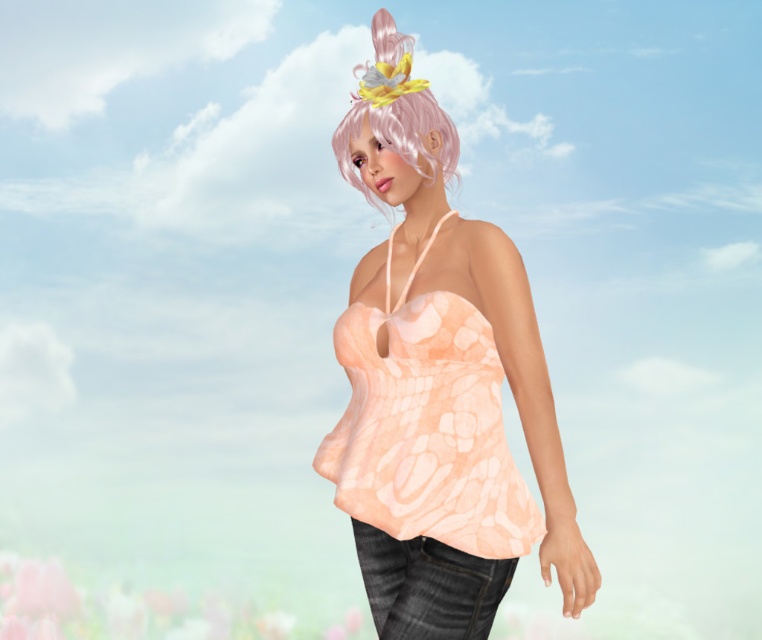
In the scene shown: Does peachy fabric top at center appear on the right side of pastel peach fabric dress at center?

Indeed, peachy fabric top at center is positioned on the right side of pastel peach fabric dress at center.

Is point (447, 570) positioned before point (396, 410)?

No, it is not.

Is point (354, 109) positioned behind point (328, 442)?

No, it is not.

Locate an element on the screen. peachy fabric top at center is located at coordinates (439, 380).

Which is more to the left, pastel peach fabric dress at center or pink matte wig at upper center?

pink matte wig at upper center is more to the left.

Can you confirm if pastel peach fabric dress at center is taller than pink matte wig at upper center?

Correct, pastel peach fabric dress at center is much taller as pink matte wig at upper center.

Where is `pastel peach fabric dress at center`? The height and width of the screenshot is (640, 762). pastel peach fabric dress at center is located at coordinates (426, 426).

Does peachy fabric top at center have a greater height compared to pink matte wig at upper center?

Indeed, peachy fabric top at center has a greater height compared to pink matte wig at upper center.

Does peachy fabric top at center appear under pink matte wig at upper center?

Yes, peachy fabric top at center is below pink matte wig at upper center.

Find the location of a particular element. This screenshot has height=640, width=762. peachy fabric top at center is located at coordinates click(439, 380).

Where is `peachy fabric top at center`? peachy fabric top at center is located at coordinates (439, 380).